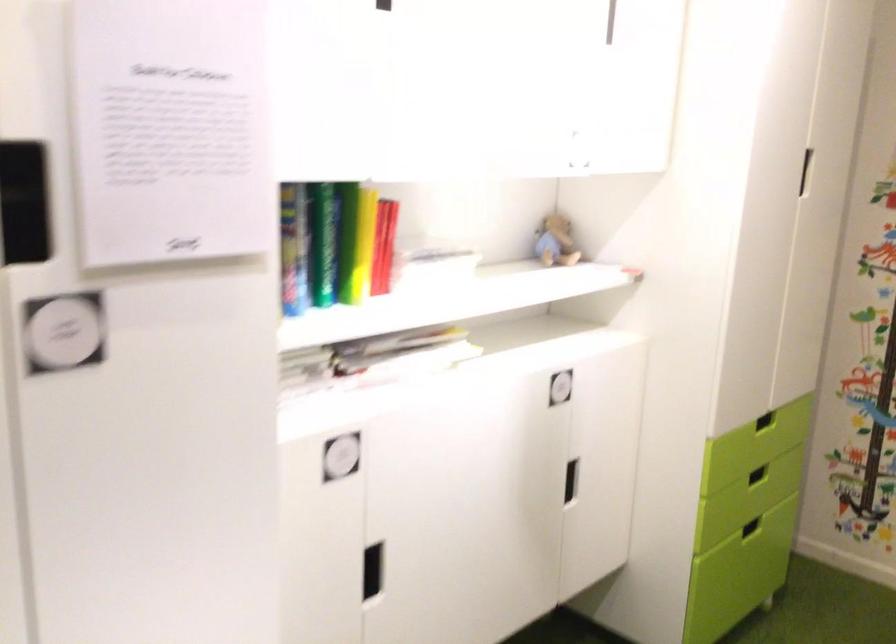
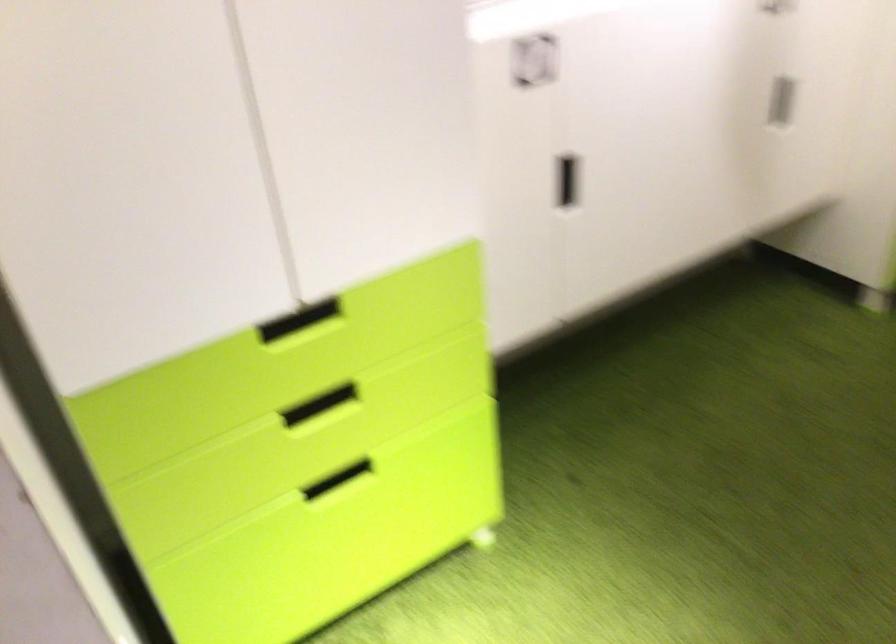
In a continuous first-person perspective shot, in which direction is the camera moving?

The cameraman moved toward right, backward.